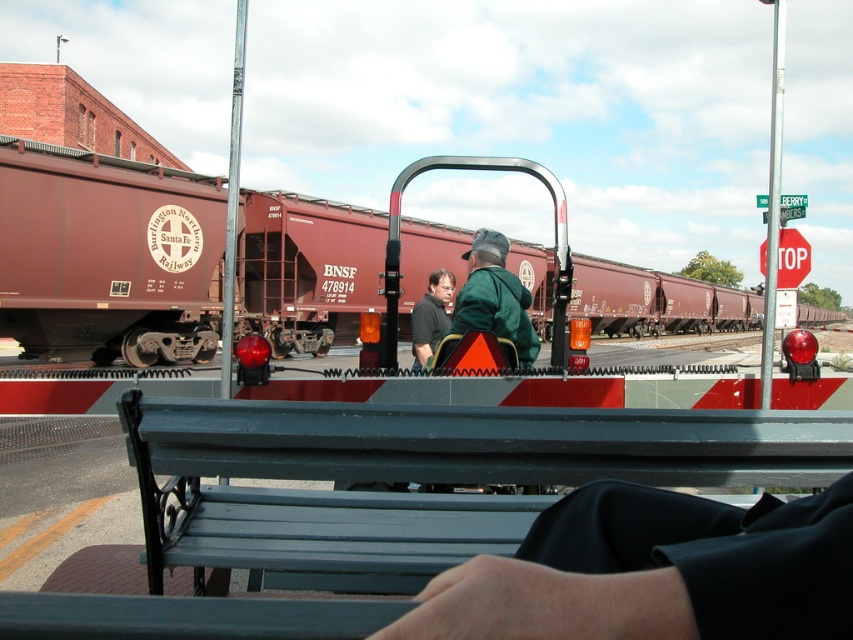
You are a pedestrian at the railroad crossing and want to reach the red plastic stop sign at upper right. Which direction should you walk from the metallic gray bench at center to get there?

You should walk to the right from the metallic gray bench at center because it is located to the left of the red plastic stop sign at upper right.

You are a pedestrian standing at the railroad crossing and see the train passing by. You notice a specific point marked at coordinates (494,298). According to the scene, where is this point located?

The point marked at coordinates (494,298) is located on the green matte jacket at center.

From the picture: You are a pedestrian standing at the railroad crossing and see the metallic gray bench at center and the dark green fabric at center. Which object is closer to the left side of the crossing?

The metallic gray bench at center is closer to the left side of the crossing because it is positioned to the left of the dark green fabric at center.